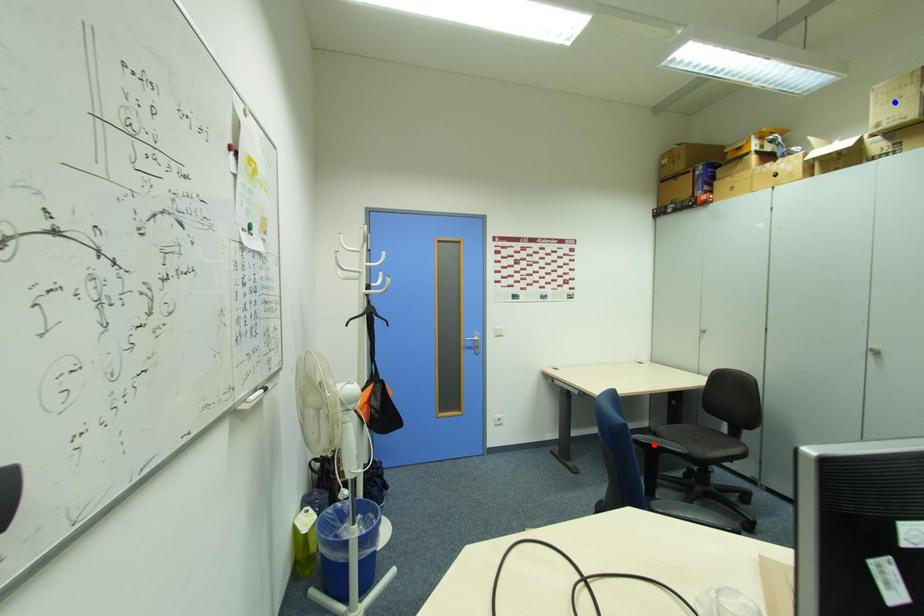
Question: Two points are marked on the image. Which point is closer to the camera?

Choices:
 (A) Blue point is closer.
 (B) Red point is closer.

Answer: (A)